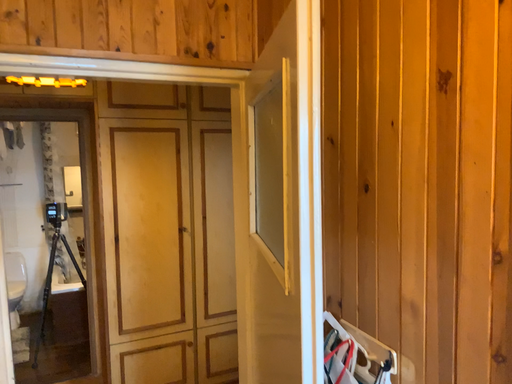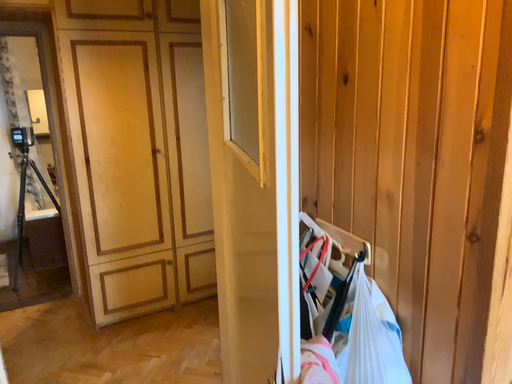
Question: How did the camera likely rotate when shooting the video?

Choices:
 (A) rotated upward
 (B) rotated downward

Answer: (B)